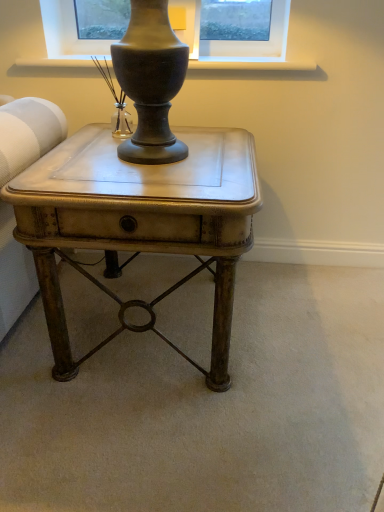
Where is `empty space that is ontop of matte brown side table at center (from a real-world perspective)`? This screenshot has height=512, width=384. empty space that is ontop of matte brown side table at center (from a real-world perspective) is located at coordinates (147, 159).